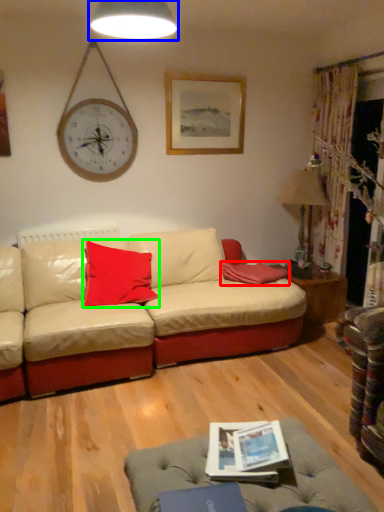
Question: Which object is positioned closest to pillow (highlighted by a red box)? Select from lamp (highlighted by a blue box) and pillow (highlighted by a green box).

Choices:
 (A) lamp
 (B) pillow

Answer: (B)